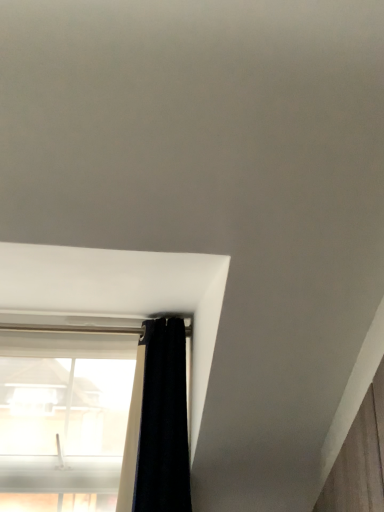
The image size is (384, 512). In order to click on black matte curtain at lower left in this screenshot , I will do `click(157, 424)`.

This screenshot has width=384, height=512. What do you see at coordinates (157, 424) in the screenshot?
I see `black matte curtain at lower left` at bounding box center [157, 424].

This screenshot has width=384, height=512. Identify the location of black matte curtain at lower left. (157, 424).